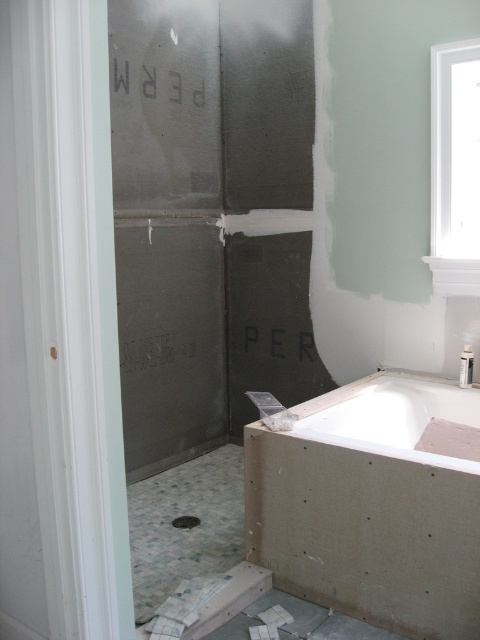
You are a contractor inspecting the bathroom renovation. You see the white matte bathtub at lower right and the white glossy bathtub at center. Which one is positioned closer to the entrance of the bathroom?

The white matte bathtub at lower right is closer to the viewer than the white glossy bathtub at center, so the white matte bathtub at lower right is positioned closer to the entrance of the bathroom.

You are a contractor inspecting the bathroom renovation. You see the white matte bathtub at lower right and the white glossy bathtub at center. Which bathtub is positioned lower in the image?

The white matte bathtub at lower right is positioned lower than the white glossy bathtub at center.